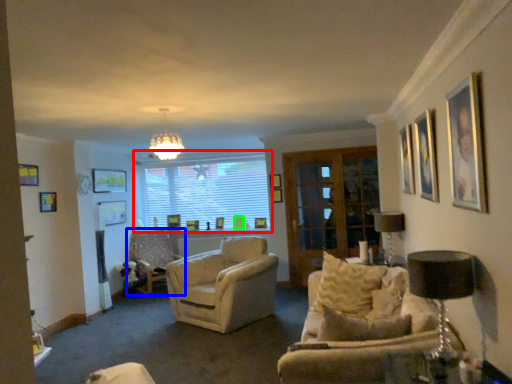
Question: Estimate the real-world distances between objects in this image. Which object is farther from window (highlighted by a red box), chair (highlighted by a blue box) or picture frame (highlighted by a green box)?

Choices:
 (A) chair
 (B) picture frame

Answer: (A)